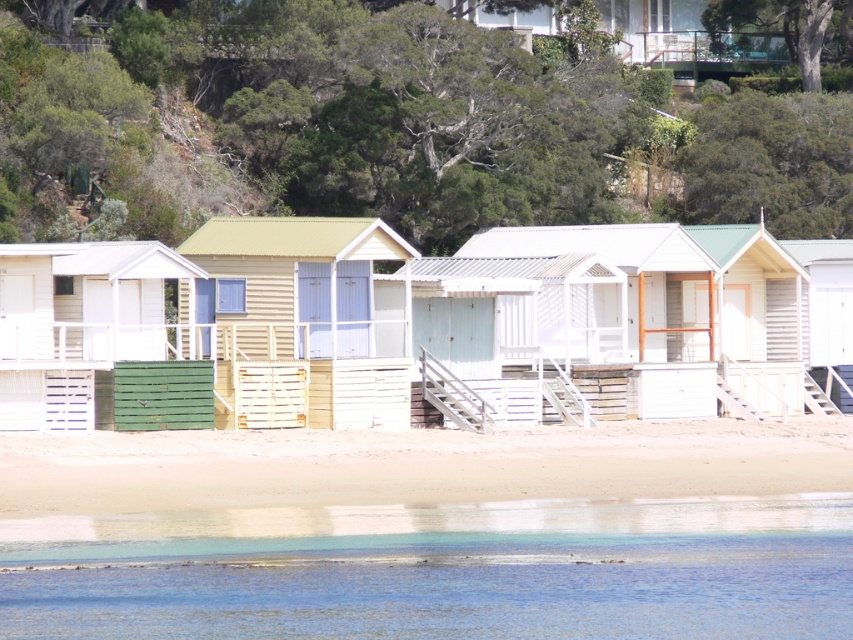
You are a delivery person who needs to place a package between the wooden beach hut at center and the matte green wood beach hut at left. The package requires a space of 7 feet. Can you fit it between them?

The wooden beach hut at center and the matte green wood beach hut at left are 7.01 feet apart from each other, so yes, the package can fit between them since the distance is slightly more than 7 feet.

You are planning to set up a small picnic area between the wooden beach hut at center and the matte green wood beach hut at left. Given that your picnic blanket requires 2 meters of space, can you determine if there is enough space between them?

The wooden beach hut at center is wider than the matte green wood beach hut at left, but the description does not provide the exact distance between them. Therefore, it is unclear if there is sufficient space for the picnic blanket requiring 2 meters.

You are standing on the sandy shoreline and want to walk to the wooden beach hut at center. Which direction should you go relative to the matte green wood beach hut at left?

The wooden beach hut at center is positioned over the matte green wood beach hut at left, so you should walk towards the center direction relative to the matte green wood beach hut at left.